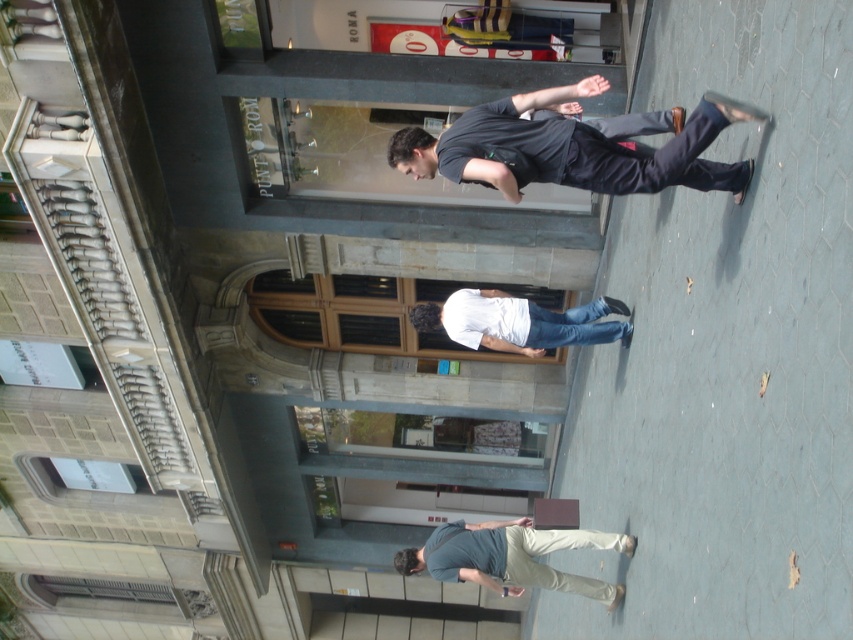
Which is behind, point (498, 173) or point (491, 529)?

Positioned behind is point (491, 529).

Is dark blue jeans at center shorter than gray cotton shirt at lower center?

In fact, dark blue jeans at center may be taller than gray cotton shirt at lower center.

Which is in front, point (662, 184) or point (520, 570)?

Point (662, 184)

This screenshot has width=853, height=640. I want to click on dark blue jeans at center, so point(575,147).

Can you confirm if gray cotton shirt at lower center is positioned above white matte shirt at center?

No, gray cotton shirt at lower center is not above white matte shirt at center.

Is gray cotton shirt at lower center closer to camera compared to white matte shirt at center?

Yes, it is.

In order to click on gray cotton shirt at lower center in this screenshot , I will do `click(511, 557)`.

The width and height of the screenshot is (853, 640). What are the coordinates of `gray cotton shirt at lower center` in the screenshot? It's located at (511, 557).

Does dark blue jeans at center have a lesser height compared to white matte shirt at center?

In fact, dark blue jeans at center may be taller than white matte shirt at center.

Is dark blue jeans at center below white matte shirt at center?

No.

Where is `dark blue jeans at center`? Image resolution: width=853 pixels, height=640 pixels. dark blue jeans at center is located at coordinates (575, 147).

This screenshot has height=640, width=853. In order to click on dark blue jeans at center in this screenshot , I will do `click(575, 147)`.